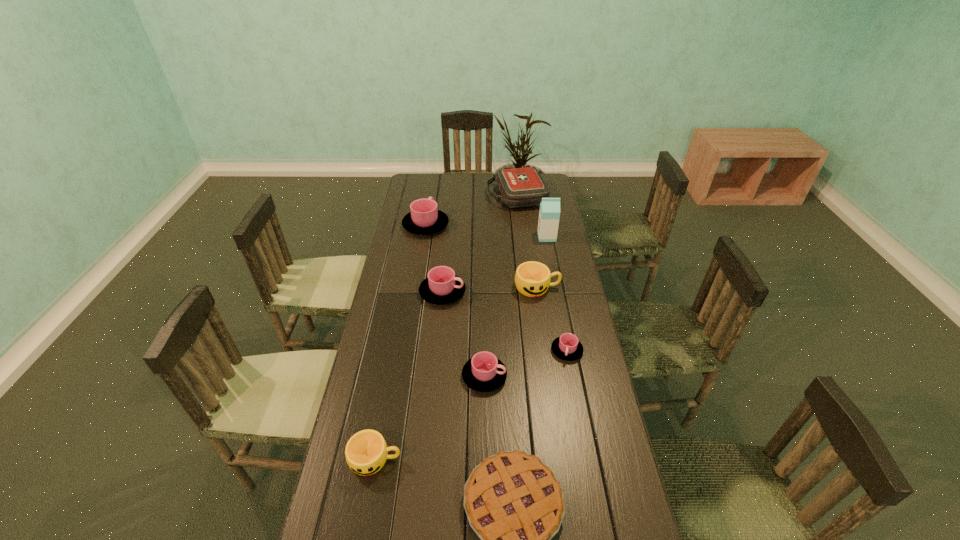
You are a GUI agent. You are given a task and a screenshot of the screen. Output one action in this format:
    pyautogui.click(x=<x>, y=<y>)
    Task: Click on the white milk carton
    The image size is (960, 540).
    Given the screenshot: What is the action you would take?
    pyautogui.click(x=549, y=214)

The image size is (960, 540). What are the coordinates of `the tallest object` in the screenshot? It's located at (549, 214).

Locate an element on the screen. The width and height of the screenshot is (960, 540). the farthest cup is located at coordinates (424, 218).

This screenshot has width=960, height=540. What are the coordinates of `the farthest pink cup` in the screenshot? It's located at (424, 218).

Identify the location of the farthest object. The height and width of the screenshot is (540, 960). (x=523, y=187).

Image resolution: width=960 pixels, height=540 pixels. Find the location of `the first-aid kit`. the first-aid kit is located at coordinates (523, 187).

What are the coordinates of `the third nearest pink cup` in the screenshot? It's located at (442, 286).

This screenshot has height=540, width=960. Find the location of `the farther beige cup`. the farther beige cup is located at coordinates (532, 279).

The image size is (960, 540). I want to click on the right beige cup, so click(532, 279).

I want to click on the third biggest pink cup, so click(x=484, y=372).